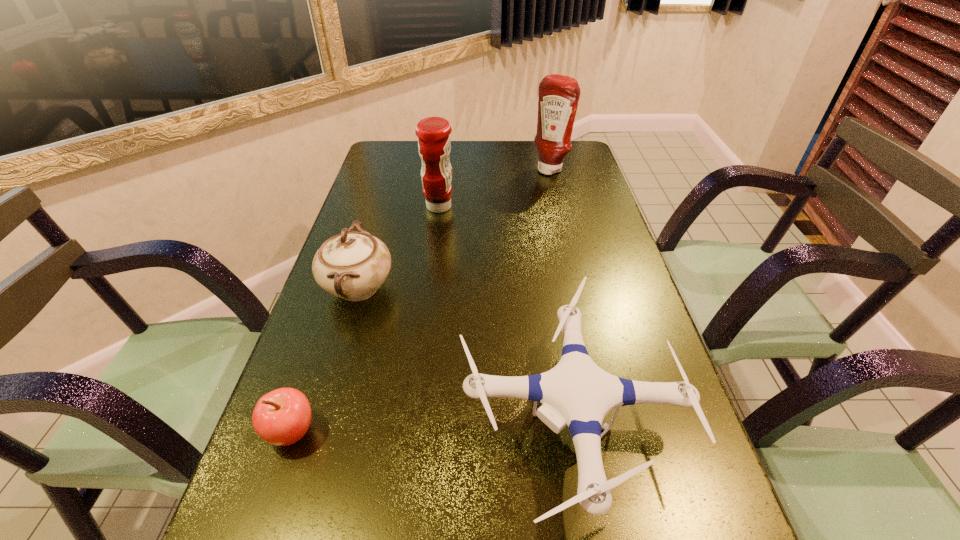
Where is `object positioned at the far edge`? object positioned at the far edge is located at coordinates (559, 95).

The height and width of the screenshot is (540, 960). Find the location of `chinaware at the left edge`. chinaware at the left edge is located at coordinates (352, 265).

The width and height of the screenshot is (960, 540). I want to click on apple present at the left edge, so click(281, 417).

Where is `object that is positioned at the right edge`? The height and width of the screenshot is (540, 960). object that is positioned at the right edge is located at coordinates coord(559,95).

You are a GUI agent. You are given a task and a screenshot of the screen. Output one action in this format:
    pyautogui.click(x=<x>, y=<y>)
    Task: Click on the object positioned at the far right corner
    
    Given the screenshot: What is the action you would take?
    pyautogui.click(x=559, y=95)

You are a GUI agent. You are given a task and a screenshot of the screen. Output one action in this format:
    pyautogui.click(x=<x>, y=<y>)
    Task: Click on the vacant area at the far edge
    This screenshot has height=540, width=960.
    Given the screenshot: What is the action you would take?
    pyautogui.click(x=464, y=157)

This screenshot has width=960, height=540. In the image, there is a desktop. In order to click on vacant space at the left edge in this screenshot , I will do `click(385, 315)`.

Locate an element on the screen. This screenshot has height=540, width=960. free region at the right edge of the desktop is located at coordinates pyautogui.click(x=643, y=333).

In the image, there is a desktop. Where is `vacant space at the far left corner`? Image resolution: width=960 pixels, height=540 pixels. vacant space at the far left corner is located at coordinates (393, 147).

Find the location of a particular element. vacant space in between the nearer condiment and the third tallest object is located at coordinates (398, 247).